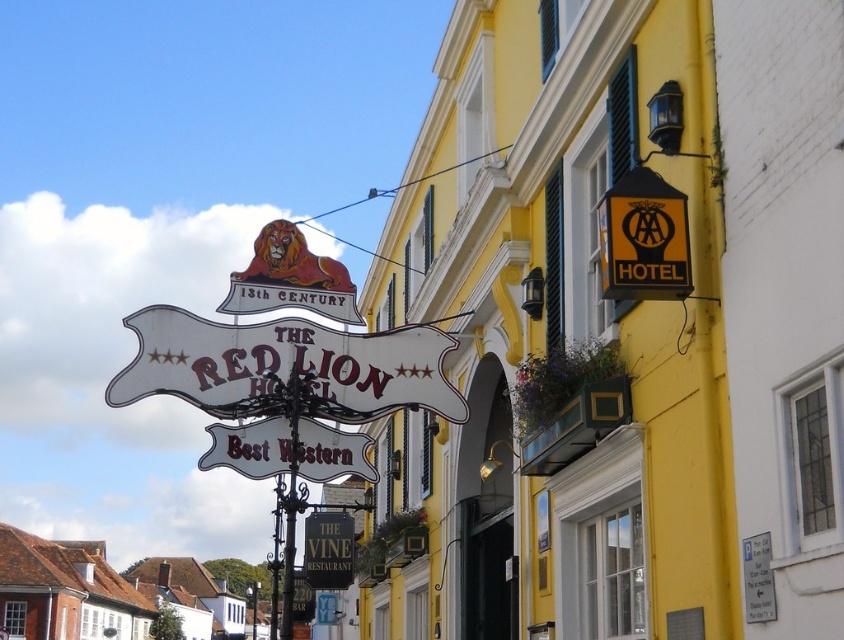
Which is more to the left, brown tiled roofs at lower left or black signboard at center?

From the viewer's perspective, brown tiled roofs at lower left appears more on the left side.

Which is in front, point (195, 593) or point (311, 580)?

Positioned in front is point (311, 580).

Locate an element on the screen. The width and height of the screenshot is (844, 640). brown tiled roofs at lower left is located at coordinates (65, 589).

Looking at this image, is white matte signboard at center behind black wrought iron pole at center?

No, white matte signboard at center is in front of black wrought iron pole at center.

Is point (352, 342) more distant than point (296, 499)?

That is True.

Is point (387, 392) less distant than point (280, 605)?

Yes.

Identify the location of white matte signboard at center. (285, 368).

Between white matte signboard at center and brown tiled roofs at lower left, which one appears on the right side from the viewer's perspective?

From the viewer's perspective, white matte signboard at center appears more on the right side.

Measure the distance between white matte signboard at center and brown tiled roofs at lower left.

They are 197.48 meters apart.

Is point (419, 378) positioned in front of point (74, 598)?

Yes, point (419, 378) is closer to viewer.

At what (x,y) coordinates should I click in order to perform the action: click on white matte signboard at center. Please return your answer as a coordinate pair (x, y). Looking at the image, I should click on 285,368.